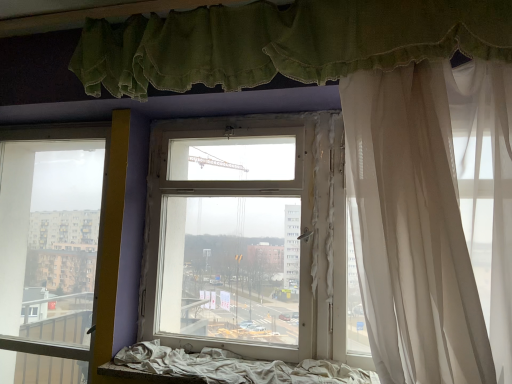
Question: Would you say white fabric bed frame at lower center contains white sheer curtain at right, positioned as the 1th curtain in bottom-to-top order?

Choices:
 (A) yes
 (B) no

Answer: (B)

Question: Is white fabric bed frame at lower center shorter than white sheer curtain at right, positioned as the 1th curtain in bottom-to-top order?

Choices:
 (A) yes
 (B) no

Answer: (A)

Question: From a real-world perspective, is white fabric bed frame at lower center on white sheer curtain at right, positioned as the 1th curtain in bottom-to-top order?

Choices:
 (A) yes
 (B) no

Answer: (B)

Question: Can you confirm if white fabric bed frame at lower center is wider than white sheer curtain at right, positioned as the 1th curtain in bottom-to-top order?

Choices:
 (A) no
 (B) yes

Answer: (A)

Question: Does white fabric bed frame at lower center have a smaller size compared to white sheer curtain at right, the second curtain from the top?

Choices:
 (A) no
 (B) yes

Answer: (B)

Question: Can you confirm if white fabric bed frame at lower center is thinner than white sheer curtain at right, positioned as the 1th curtain in bottom-to-top order?

Choices:
 (A) no
 (B) yes

Answer: (B)

Question: Is transparent glass window at center, placed as the 2th window when sorted from left to right, touching white fabric bed frame at lower center?

Choices:
 (A) yes
 (B) no

Answer: (B)

Question: Considering the relative sizes of transparent glass window at center, placed as the 2th window when sorted from left to right, and white fabric bed frame at lower center in the image provided, is transparent glass window at center, placed as the 2th window when sorted from left to right, shorter than white fabric bed frame at lower center?

Choices:
 (A) yes
 (B) no

Answer: (B)

Question: From the image's perspective, does transparent glass window at center, which appears as the 1th window when viewed from the right, appear higher than white fabric bed frame at lower center?

Choices:
 (A) no
 (B) yes

Answer: (B)

Question: Is transparent glass window at center, placed as the 2th window when sorted from left to right, turned away from white fabric bed frame at lower center?

Choices:
 (A) yes
 (B) no

Answer: (B)

Question: Considering the relative sizes of transparent glass window at center, placed as the 2th window when sorted from left to right, and white fabric bed frame at lower center in the image provided, is transparent glass window at center, placed as the 2th window when sorted from left to right, smaller than white fabric bed frame at lower center?

Choices:
 (A) no
 (B) yes

Answer: (A)

Question: Does transparent glass window at center, placed as the 2th window when sorted from left to right, have a greater width compared to white fabric bed frame at lower center?

Choices:
 (A) no
 (B) yes

Answer: (A)

Question: Does green fabric curtain at upper center, positioned as the 1th curtain in top-to-bottom order, appear on the right side of transparent glass window at left, arranged as the 2th window when viewed from the right?

Choices:
 (A) no
 (B) yes

Answer: (B)